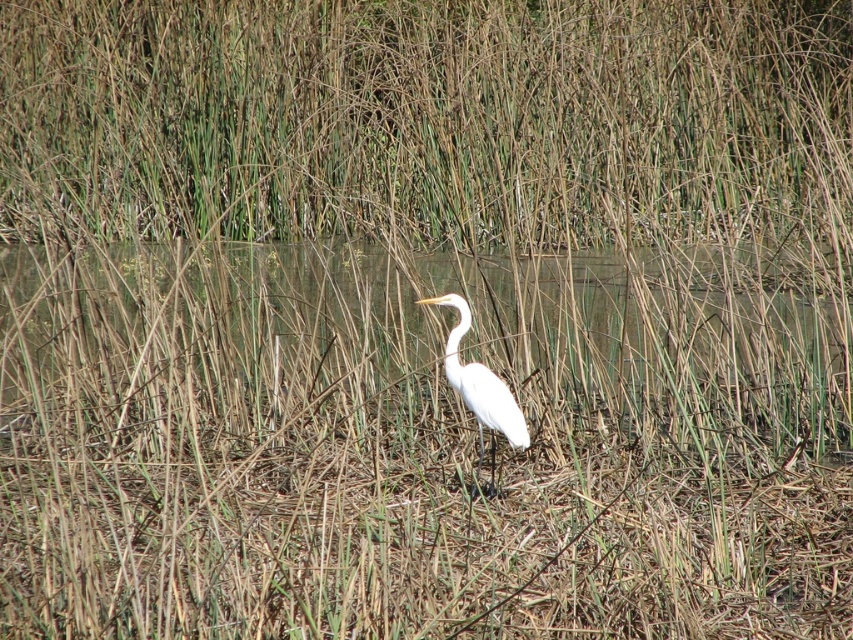
Question: Among these points, which one is nearest to the camera?

Choices:
 (A) (477, 369)
 (B) (766, 326)

Answer: (A)

Question: Can you confirm if clear water at center is positioned above white smooth heron at center?

Choices:
 (A) yes
 (B) no

Answer: (A)

Question: Observing the image, what is the correct spatial positioning of clear water at center in reference to white smooth heron at center?

Choices:
 (A) left
 (B) right

Answer: (A)

Question: Which point is farther to the camera?

Choices:
 (A) (300, 332)
 (B) (466, 404)

Answer: (A)

Question: Considering the relative positions of clear water at center and white smooth heron at center in the image provided, where is clear water at center located with respect to white smooth heron at center?

Choices:
 (A) right
 (B) left

Answer: (B)